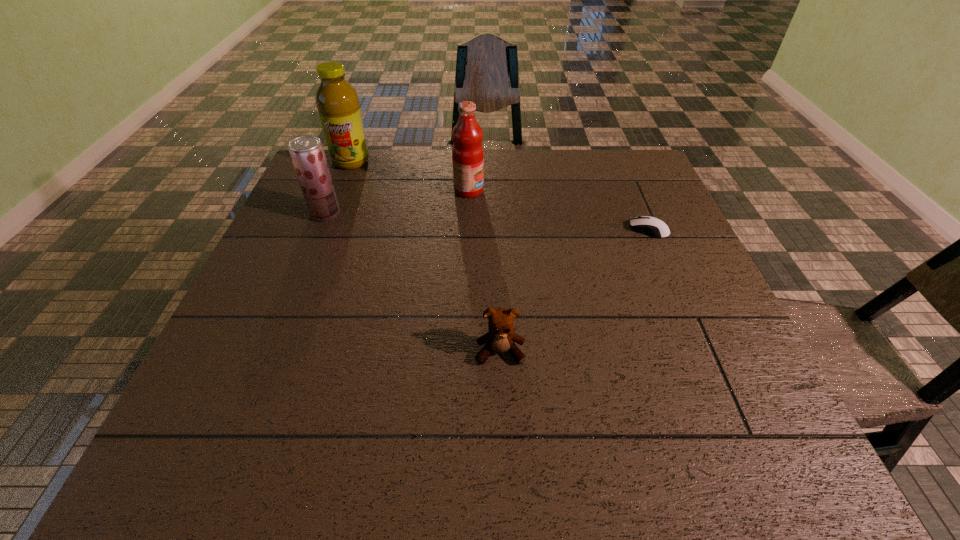
Where is `free space located 0.160m on the front label of the rightmost fruit juice`? The width and height of the screenshot is (960, 540). free space located 0.160m on the front label of the rightmost fruit juice is located at coordinates (539, 191).

Locate an element on the screen. Image resolution: width=960 pixels, height=540 pixels. vacant space located on the front of the nearest fruit juice is located at coordinates (272, 346).

You are a GUI agent. You are given a task and a screenshot of the screen. Output one action in this format:
    pyautogui.click(x=<x>, y=<y>)
    Task: Click on the vacant space located 0.090m on the front-facing side of the fourth tallest object
    
    Given the screenshot: What is the action you would take?
    pyautogui.click(x=502, y=409)

This screenshot has height=540, width=960. In order to click on free location located on the front of the mouse in this screenshot , I will do `click(664, 267)`.

In order to click on object that is at the right edge in this screenshot , I will do `click(651, 226)`.

Locate an element on the screen. object present at the far left corner is located at coordinates (337, 101).

I want to click on vacant space at the far edge, so click(589, 180).

In the image, there is a desktop. At what (x,y) coordinates should I click in order to perform the action: click on vacant area at the near edge. Please return your answer as a coordinate pair (x, y). This screenshot has width=960, height=540. Looking at the image, I should click on (324, 455).

This screenshot has height=540, width=960. In the image, there is a desktop. In order to click on blank space at the left edge in this screenshot , I will do `click(266, 272)`.

In the image, there is a desktop. Identify the location of free space at the right edge. This screenshot has width=960, height=540. pyautogui.click(x=690, y=251).